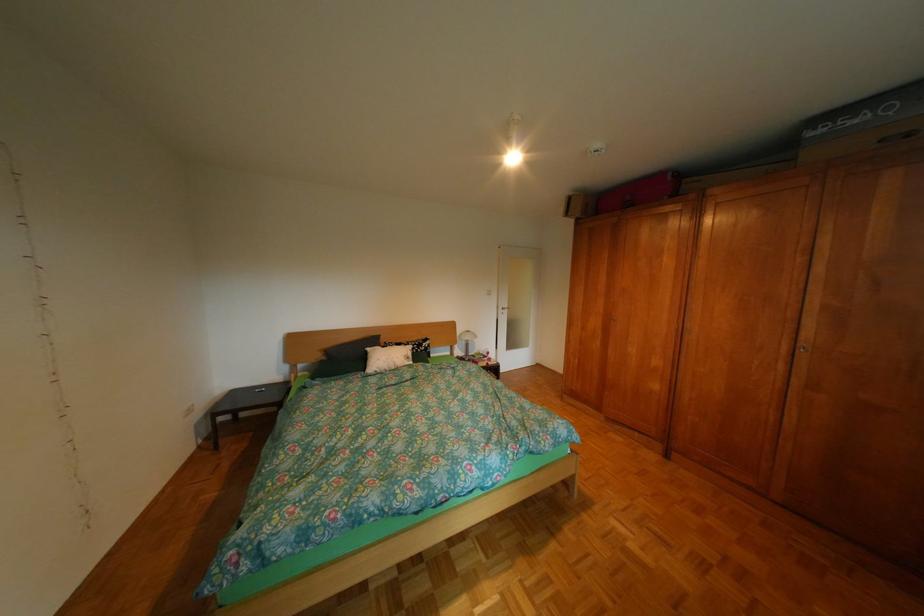
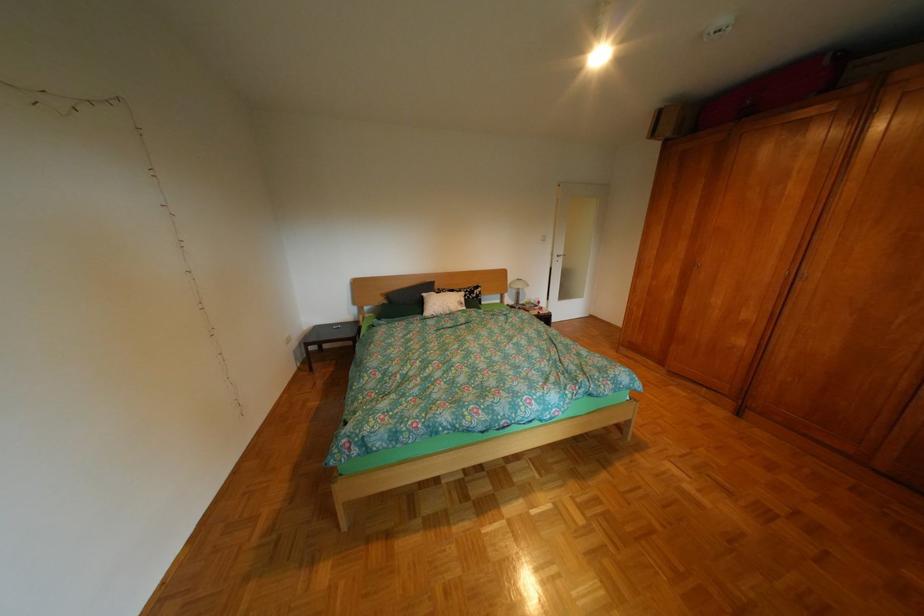
Locate, in the second image, the point that corresponds to pixel 338 359 in the first image.

(400, 302)